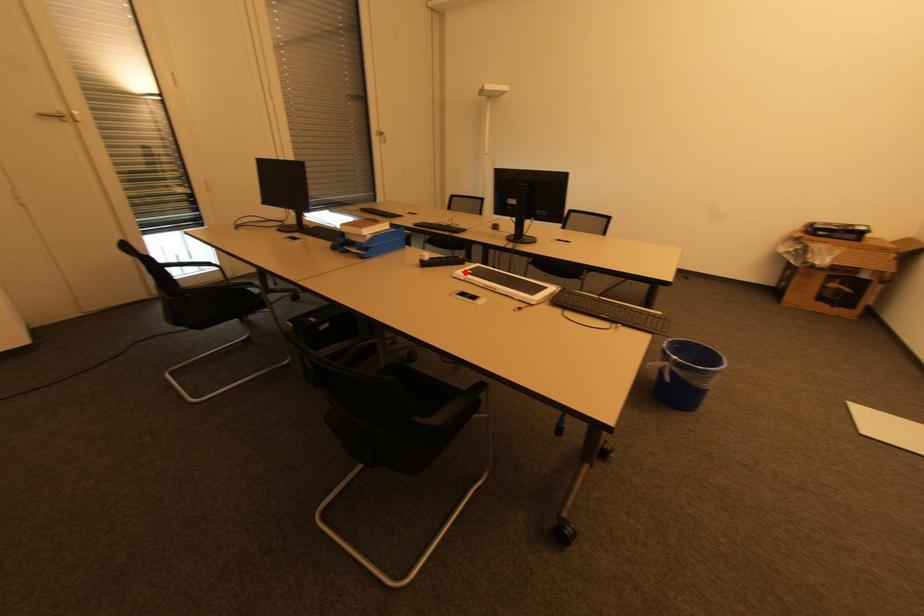
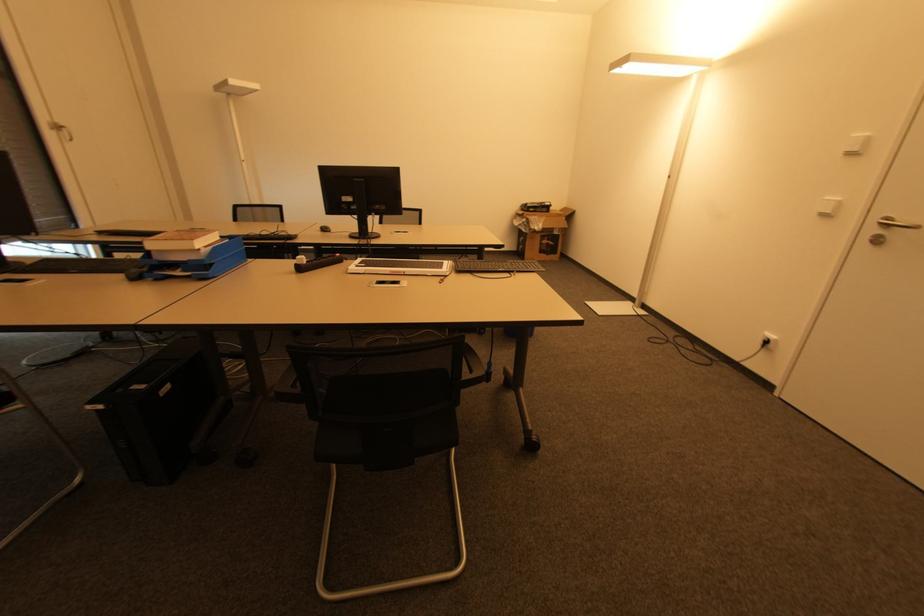
The point at the highlighted location is marked in the first image. Where is the corresponding point in the second image?

(359, 267)